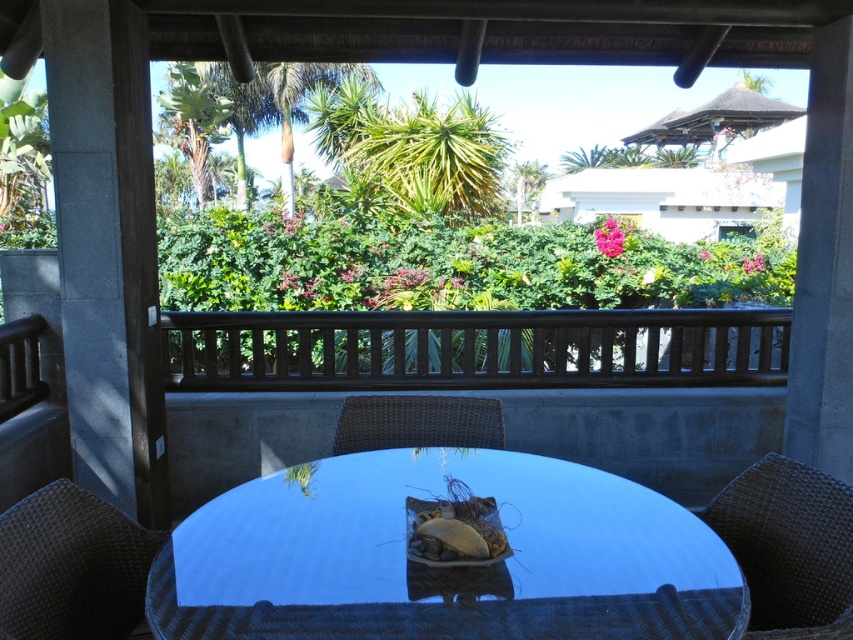
Question: Which point is closer to the camera?

Choices:
 (A) woven dark brown chair at lower right
 (B) smooth glass table at center
 (C) woven brown chair at center

Answer: (B)

Question: Is smooth glass table at center positioned before green leafy palm tree at center?

Choices:
 (A) yes
 (B) no

Answer: (A)

Question: Which point appears farthest from the camera in this image?

Choices:
 (A) (364, 132)
 (B) (51, 598)
 (C) (372, 404)

Answer: (A)

Question: Estimate the real-world distances between objects in this image. Which object is farther from the woven dark brown chair at lower right?

Choices:
 (A) woven dark brown chair at lower left
 (B) green leafy palm tree at upper left
 (C) smooth glass table at center
 (D) green leafy palm tree at center

Answer: (B)

Question: Does woven dark brown chair at lower left have a greater width compared to woven dark brown chair at lower right?

Choices:
 (A) no
 (B) yes

Answer: (A)

Question: Is woven dark brown chair at lower right above woven brown chair at center?

Choices:
 (A) no
 (B) yes

Answer: (A)